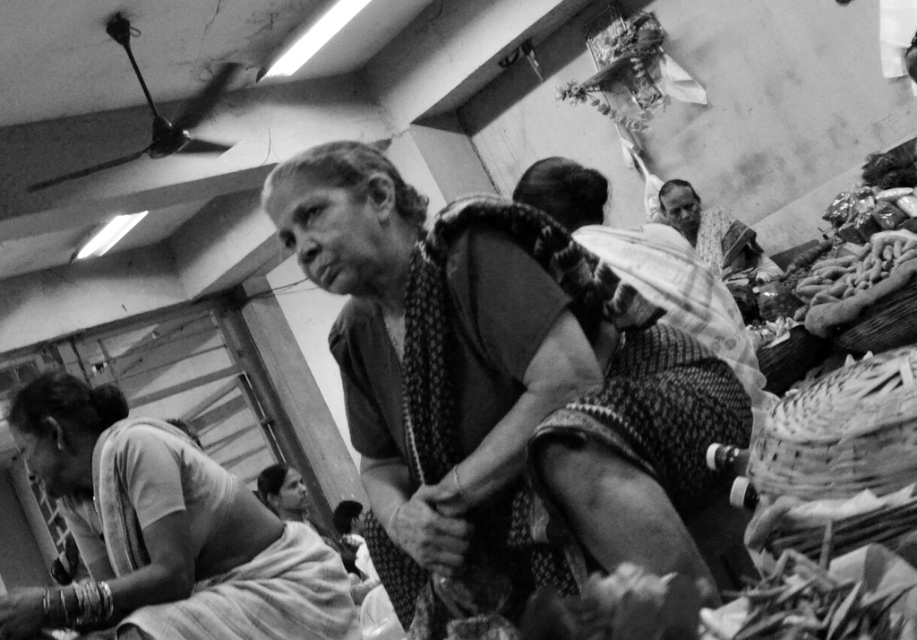
From the picture: Can you confirm if patterned fabric saree at center is positioned to the right of patterned fabric man at upper right?

In fact, patterned fabric saree at center is to the left of patterned fabric man at upper right.

Is point (450, 298) positioned after point (691, 228)?

No, (450, 298) is closer to viewer.

Identify the location of patterned fabric saree at center. (418, 337).

Is patterned fabric saree at center further to camera compared to silky white saree at left?

No, it is in front of silky white saree at left.

Is patterned fabric saree at center positioned in front of silky white saree at left?

That is True.

Which is in front, point (576, 326) or point (159, 520)?

Point (576, 326) is more forward.

The height and width of the screenshot is (640, 917). In order to click on patterned fabric saree at center in this screenshot , I will do click(418, 337).

Measure the distance from silky white saree at left to patterned fabric man at upper right.

silky white saree at left is 3.05 meters away from patterned fabric man at upper right.

Is silky white saree at left shorter than patterned fabric man at upper right?

Yes, silky white saree at left is shorter than patterned fabric man at upper right.

Does point (168, 595) lie behind point (657, 202)?

That is False.

You are a GUI agent. You are given a task and a screenshot of the screen. Output one action in this format:
    pyautogui.click(x=<x>, y=<y>)
    Task: Click on the silky white saree at left
    
    Given the screenshot: What is the action you would take?
    pyautogui.click(x=163, y=532)